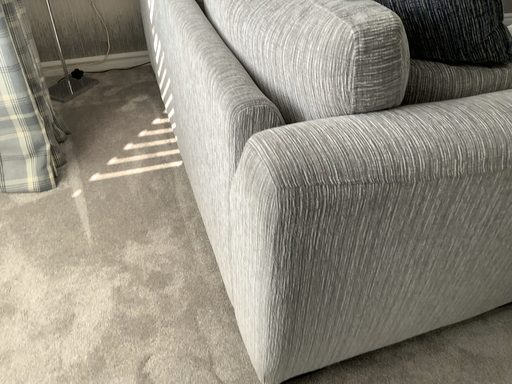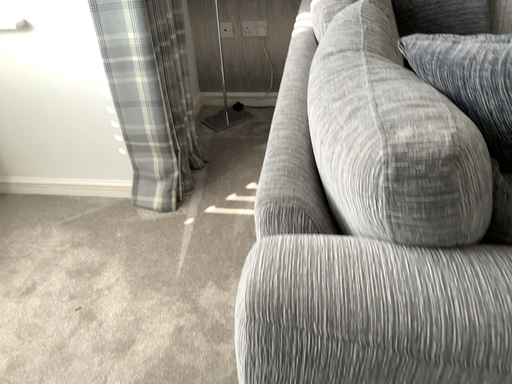
Question: How did the camera likely rotate when shooting the video?

Choices:
 (A) rotated upward
 (B) rotated downward

Answer: (A)